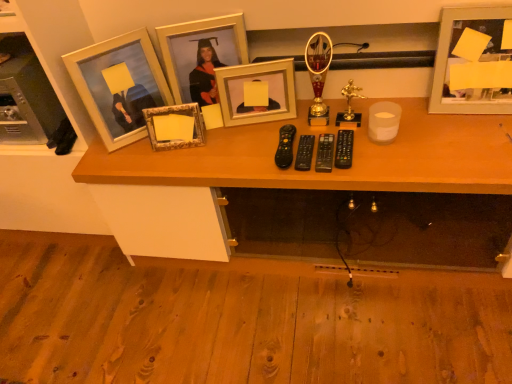
Find the location of `free space in front of gold metallic picture frame at upper center, arranged as the 3th picture frame when viewed from the left`. free space in front of gold metallic picture frame at upper center, arranged as the 3th picture frame when viewed from the left is located at coordinates (224, 143).